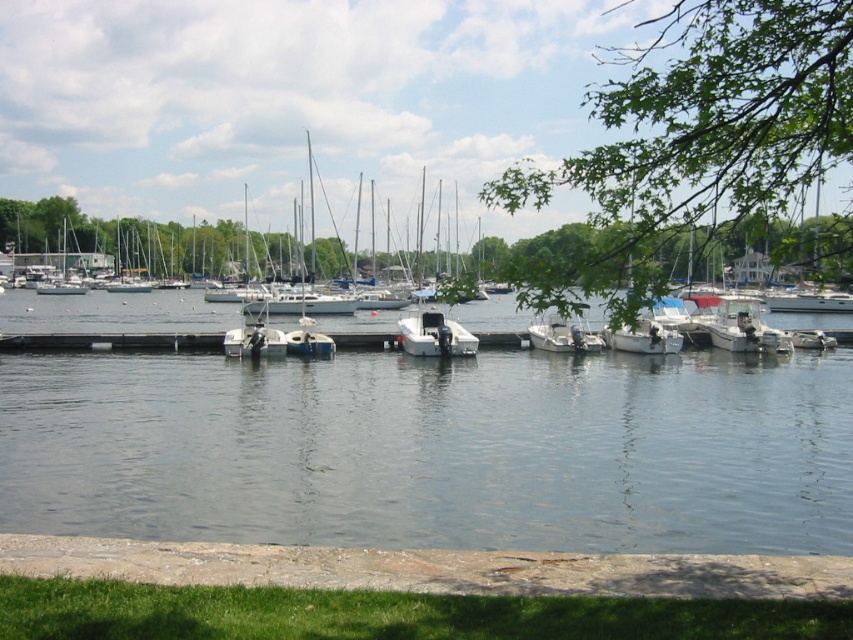
You are an observer standing at the shoreline looking out towards the water. You notice the green leafy tree at upper right and the white matte sailboat at center. Which object appears taller from your vantage point?

The green leafy tree at upper right appears taller than the white matte sailboat at center from your vantage point because the green leafy tree at upper right has a greater height compared to the white matte sailboat at center.

You are standing at the center of the wooden pier in the marina scene. You see a point marked at coordinates (744, 326). What object is located at that point?

The point at coordinates (744, 326) marks the white matte boat at center right.